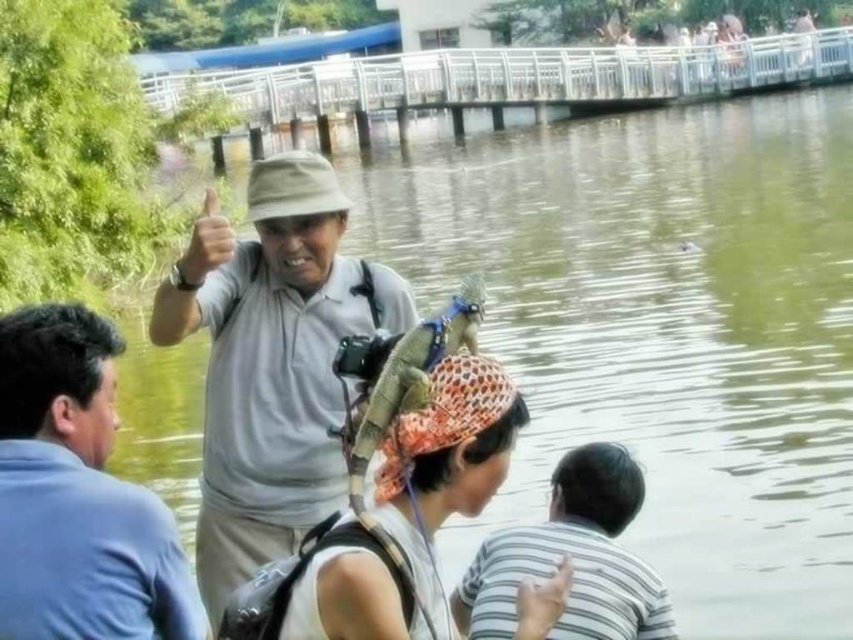
Can you confirm if blue shirt at left is smaller than leather-like headscarf at center?

Answer: Incorrect, blue shirt at left is not smaller in size than leather-like headscarf at center.

Is blue shirt at left thinner than leather-like headscarf at center?

No, blue shirt at left is not thinner than leather-like headscarf at center.

Measure the distance between blue shirt at left and camera.

blue shirt at left and camera are 68.89 feet apart from each other.

The height and width of the screenshot is (640, 853). Identify the location of blue shirt at left. (77, 496).

Between leather-like headscarf at center and striped cotton shirt at lower right, which one has more height?

striped cotton shirt at lower right is taller.

Does leather-like headscarf at center come behind striped cotton shirt at lower right?

No, it is in front of striped cotton shirt at lower right.

Is point (425, 604) farther from camera compared to point (515, 573)?

That is False.

Where is `leather-like headscarf at center`? leather-like headscarf at center is located at coordinates (445, 464).

Which is behind, point (213, 474) or point (469, 600)?

Point (213, 474)

Which is below, matte gray shirt at center or striped cotton shirt at lower right?

Positioned lower is striped cotton shirt at lower right.

The image size is (853, 640). In order to click on matte gray shirt at center in this screenshot , I will do `click(271, 362)`.

I want to click on matte gray shirt at center, so click(x=271, y=362).